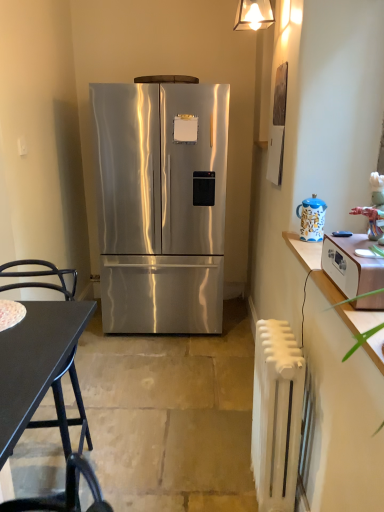
At what (x,y) coordinates should I click in order to perform the action: click on free space that is to the left of white painted metal radiator at right. Please return your answer as a coordinate pair (x, y). Looking at the image, I should click on (212, 482).